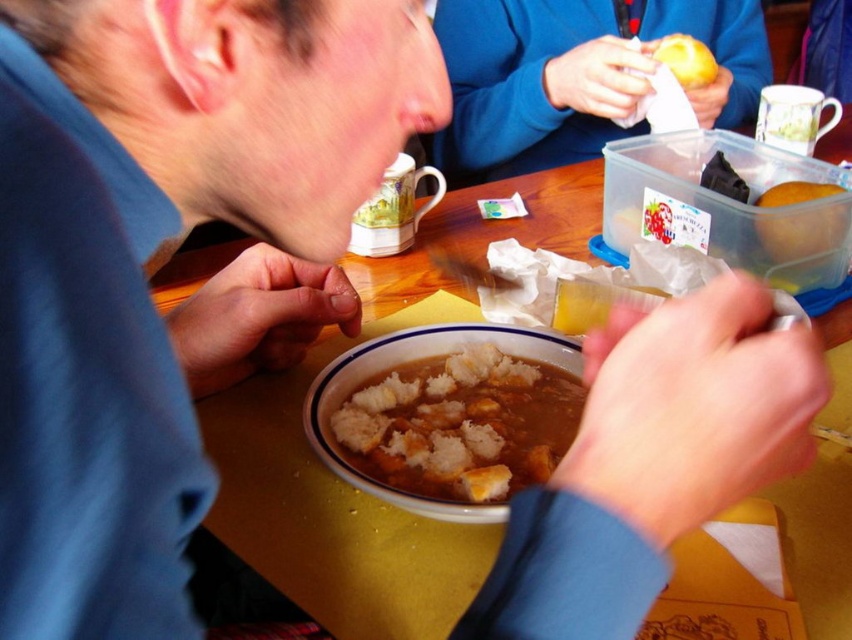
Who is higher up, brown crumbly bread at center or clear plastic container at upper right?

Positioned higher is clear plastic container at upper right.

Who is positioned more to the right, brown crumbly bread at center or clear plastic container at upper right?

From the viewer's perspective, clear plastic container at upper right appears more on the right side.

Identify the location of brown crumbly bread at center. The width and height of the screenshot is (852, 640). (459, 424).

Could you measure the distance between matte plastic container at upper center and translucent plastic container at upper right?

matte plastic container at upper center and translucent plastic container at upper right are 19.26 inches apart.

At what (x,y) coordinates should I click in order to perform the action: click on matte plastic container at upper center. Please return your answer as a coordinate pair (x, y). This screenshot has height=640, width=852. Looking at the image, I should click on (579, 76).

Who is more forward, (701, 3) or (822, 186)?

Point (822, 186)

This screenshot has width=852, height=640. Identify the location of matte plastic container at upper center. (579, 76).

Is yellow wood table at center shorter than translucent plastic container at upper right?

No.

Identify the location of yellow wood table at center. (559, 204).